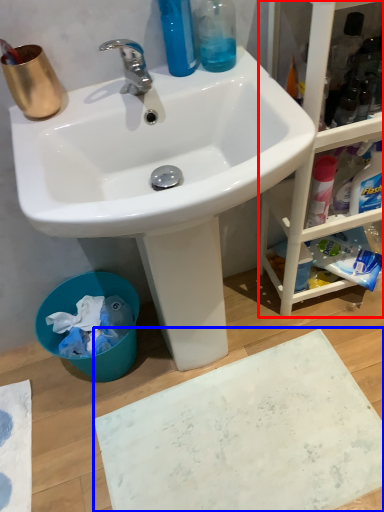
Question: Which point is closer to the camera, cabinetry (highlighted by a red box) or bath mat (highlighted by a blue box)?

Choices:
 (A) cabinetry
 (B) bath mat

Answer: (A)